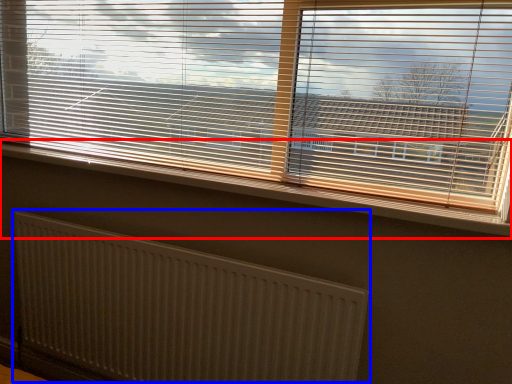
Question: Which of the following is the farthest to the observer, window sill (highlighted by a red box) or radiator (highlighted by a blue box)?

Choices:
 (A) window sill
 (B) radiator

Answer: (B)